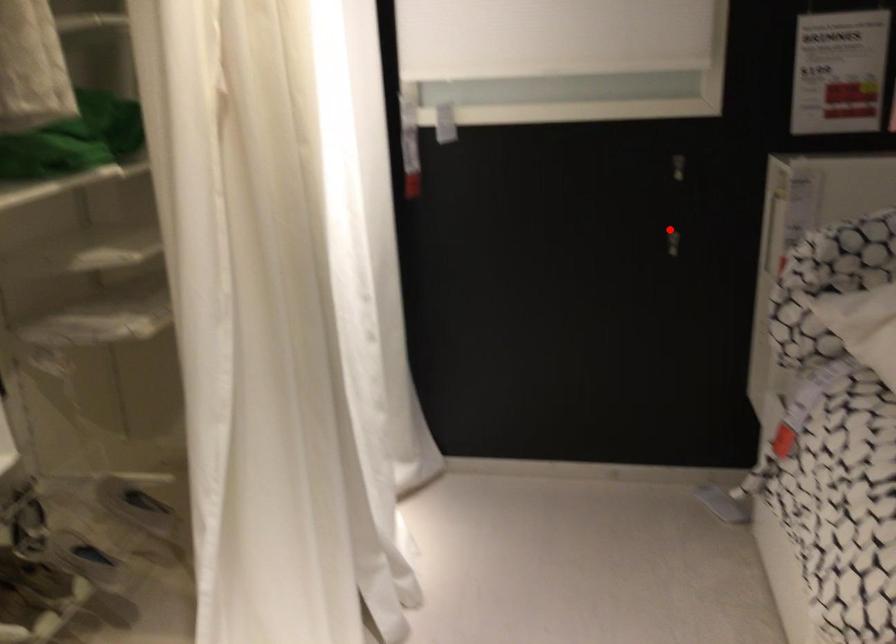
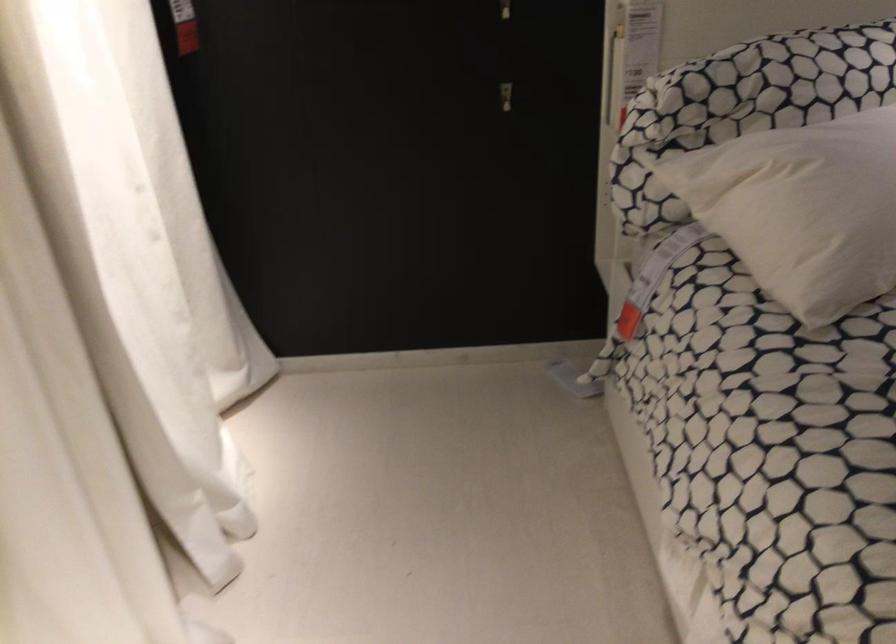
In the second image, find the point that corresponds to the highlighted location in the first image.

(504, 93)